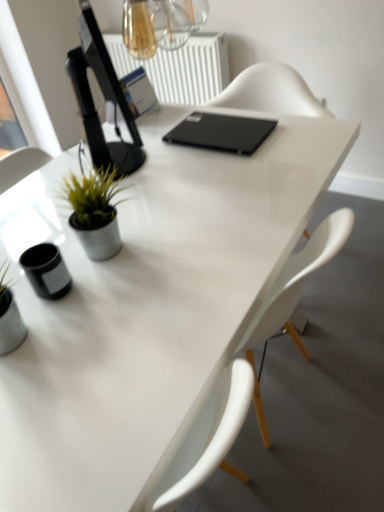
The width and height of the screenshot is (384, 512). What do you see at coordinates (221, 132) in the screenshot? I see `black matte laptop at center` at bounding box center [221, 132].

The height and width of the screenshot is (512, 384). Describe the element at coordinates (104, 96) in the screenshot. I see `black glossy computer monitor at upper left` at that location.

The image size is (384, 512). In order to click on white plastic radiator at upper center in this screenshot , I will do `click(179, 68)`.

Based on the photo, is there a large distance between transparent glass window screen at upper left and black glossy computer monitor at upper left?

Yes, transparent glass window screen at upper left and black glossy computer monitor at upper left are quite far apart.

Is transparent glass window screen at upper left in front of black glossy computer monitor at upper left?

No, transparent glass window screen at upper left is further to the viewer.

Locate an element on the screen. This screenshot has width=384, height=512. computer monitor that appears below the transparent glass window screen at upper left (from the image's perspective) is located at coordinates (104, 96).

From the image's perspective, is transparent glass window screen at upper left on black glossy computer monitor at upper left?

Yes, from the image's perspective, transparent glass window screen at upper left is above black glossy computer monitor at upper left.

This screenshot has width=384, height=512. What are the coordinates of `laptop below the transparent glass window screen at upper left (from the image's perspective)` in the screenshot? It's located at coord(221,132).

Can you confirm if transparent glass window screen at upper left is wider than black matte laptop at center?

No, transparent glass window screen at upper left is not wider than black matte laptop at center.

From the image's perspective, between transparent glass window screen at upper left and black matte laptop at center, who is located below?

black matte laptop at center is shown below in the image.

Is transparent glass window screen at upper left at the left side of black matte laptop at center?

Correct, you'll find transparent glass window screen at upper left to the left of black matte laptop at center.

Is black matte laptop at center positioned before white plastic radiator at upper center?

Yes, it is.

Is black matte laptop at center facing away from white plastic radiator at upper center?

black matte laptop at center is not turned away from white plastic radiator at upper center.

Is black matte laptop at center wider or thinner than white plastic radiator at upper center?

In the image, black matte laptop at center appears to be wider than white plastic radiator at upper center.

Identify the location of radiator below the black matte laptop at center (from a real-world perspective). The width and height of the screenshot is (384, 512). (179, 68).

Is white plastic radiator at upper center positioned with its back to black glossy computer monitor at upper left?

white plastic radiator at upper center does not have its back to black glossy computer monitor at upper left.

In the scene shown: How different are the orientations of white plastic radiator at upper center and black glossy computer monitor at upper left in degrees?

The facing directions of white plastic radiator at upper center and black glossy computer monitor at upper left are 134 degrees apart.

Is point (169, 90) positioned after point (92, 147)?

That is True.

Is white plastic radiator at upper center wider than black glossy computer monitor at upper left?

In fact, white plastic radiator at upper center might be narrower than black glossy computer monitor at upper left.

In the scene shown: Between black matte laptop at center and green matte plant at left, which one has larger size?

Bigger between the two is green matte plant at left.

Is black matte laptop at center facing away from green matte plant at left?

Yes, black matte laptop at center's orientation is away from green matte plant at left.

Which object is further away from the camera taking this photo, black matte laptop at center or green matte plant at left?

Positioned behind is black matte laptop at center.

From the image's perspective, relative to green matte plant at left, is black matte laptop at center above or below?

From the image's perspective, black matte laptop at center appears above green matte plant at left.

Is white plastic radiator at upper center to the left or to the right of transparent glass window screen at upper left in the image?

In the image, white plastic radiator at upper center appears on the right side of transparent glass window screen at upper left.

Is white plastic radiator at upper center positioned with its back to transparent glass window screen at upper left?

No, transparent glass window screen at upper left is not at the back of white plastic radiator at upper center.

From the image's perspective, between white plastic radiator at upper center and transparent glass window screen at upper left, which one is located above?

white plastic radiator at upper center is shown above in the image.

From a real-world perspective, is white plastic radiator at upper center on transparent glass window screen at upper left?

Indeed, from a real-world perspective, white plastic radiator at upper center stands above transparent glass window screen at upper left.

Does transparent glass window screen at upper left turn towards green matte plant at left?

No, transparent glass window screen at upper left is not turned towards green matte plant at left.

What's the angular difference between transparent glass window screen at upper left and green matte plant at left's facing directions?

0.000559 degrees separate the facing orientations of transparent glass window screen at upper left and green matte plant at left.

From the image's perspective, is transparent glass window screen at upper left located beneath green matte plant at left?

No, from the image's perspective, transparent glass window screen at upper left is not beneath green matte plant at left.

Identify the location of computer monitor positioned vertically above the transparent glass window screen at upper left (from a real-world perspective). (104, 96).

The height and width of the screenshot is (512, 384). Find the location of `window screen that appears above the black matte laptop at center (from the image's perspective)`. window screen that appears above the black matte laptop at center (from the image's perspective) is located at coordinates (9, 125).

Based on their spatial positions, is green matte plant at left or black glossy computer monitor at upper left further from black matte laptop at center?

green matte plant at left lies further to black matte laptop at center than the other object.

Looking at the image, which one is located closer to black matte laptop at center, white plastic radiator at upper center or black glossy computer monitor at upper left?

black glossy computer monitor at upper left is closer to black matte laptop at center.

Which object lies further to the anchor point black matte laptop at center, green matte plant at left or transparent glass window screen at upper left?

Among the two, transparent glass window screen at upper left is located further to black matte laptop at center.

When comparing their distances from transparent glass window screen at upper left, does green matte plant at left or white plastic radiator at upper center seem further?

green matte plant at left is positioned further to the anchor transparent glass window screen at upper left.

Looking at the image, which one is located closer to black glossy computer monitor at upper left, white plastic radiator at upper center or transparent glass window screen at upper left?

white plastic radiator at upper center is closer to black glossy computer monitor at upper left.

When comparing their distances from green matte plant at left, does black glossy computer monitor at upper left or transparent glass window screen at upper left seem further?

transparent glass window screen at upper left.

Which object lies further to the anchor point black glossy computer monitor at upper left, green matte plant at left or transparent glass window screen at upper left?

transparent glass window screen at upper left is positioned further to the anchor black glossy computer monitor at upper left.

From the picture: From the image, which object appears to be nearer to white plastic radiator at upper center, transparent glass window screen at upper left or black glossy computer monitor at upper left?

transparent glass window screen at upper left is closer to white plastic radiator at upper center.

You are a GUI agent. You are given a task and a screenshot of the screen. Output one action in this format:
    pyautogui.click(x=<x>, y=<y>)
    Task: Click on the radiator between transparent glass window screen at upper left and black matte laptop at center in the horizontal direction
    
    Given the screenshot: What is the action you would take?
    pyautogui.click(x=179, y=68)

Locate an element on the screen. laptop between black glossy computer monitor at upper left and white plastic radiator at upper center in the front-back direction is located at coordinates (221, 132).

Where is `computer monitor positioned between green matte plant at left and transparent glass window screen at upper left from near to far`? This screenshot has width=384, height=512. computer monitor positioned between green matte plant at left and transparent glass window screen at upper left from near to far is located at coordinates (104, 96).

Image resolution: width=384 pixels, height=512 pixels. Find the location of `radiator located between black glossy computer monitor at upper left and transparent glass window screen at upper left in the depth direction`. radiator located between black glossy computer monitor at upper left and transparent glass window screen at upper left in the depth direction is located at coordinates (x=179, y=68).